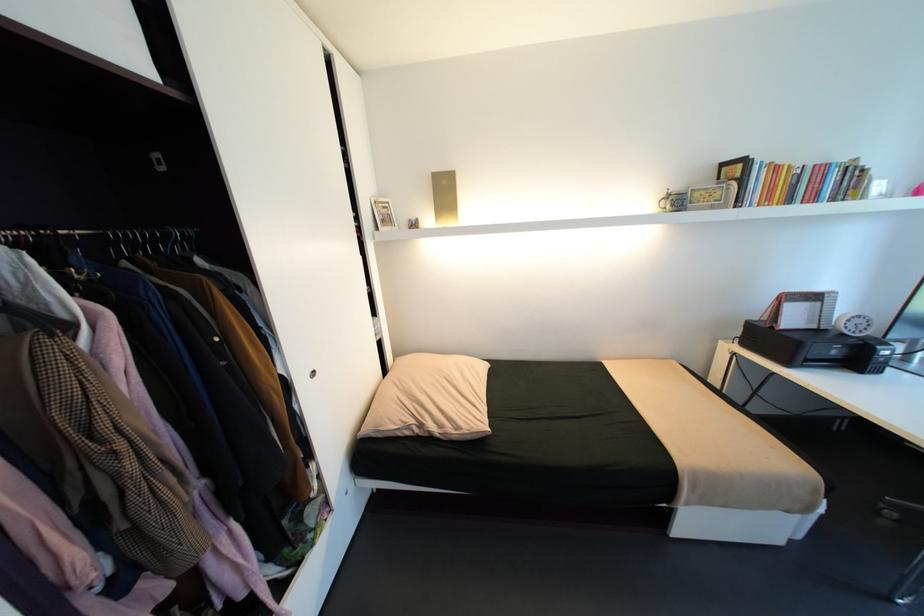
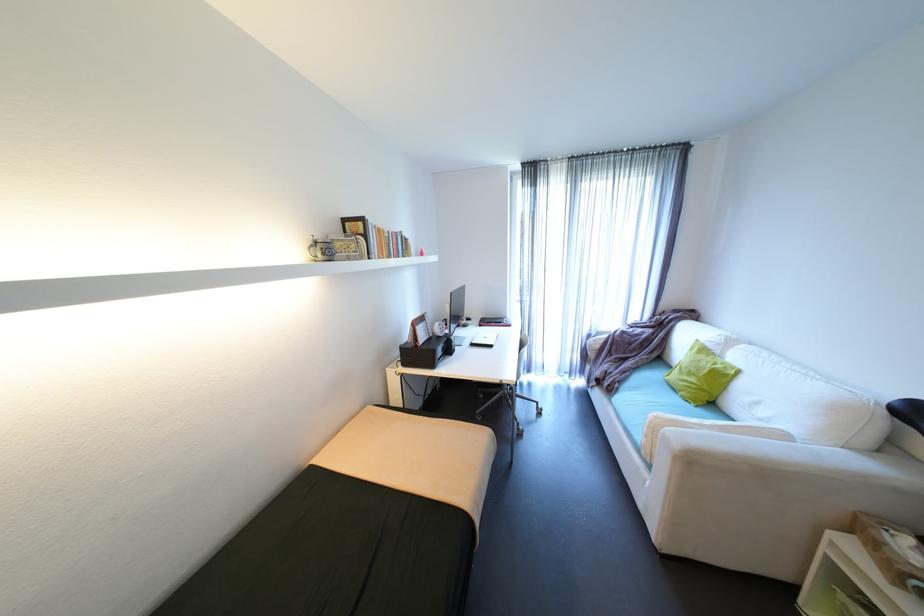
Where in the second image is the point corresponding to (x=752, y=203) from the first image?

(380, 254)